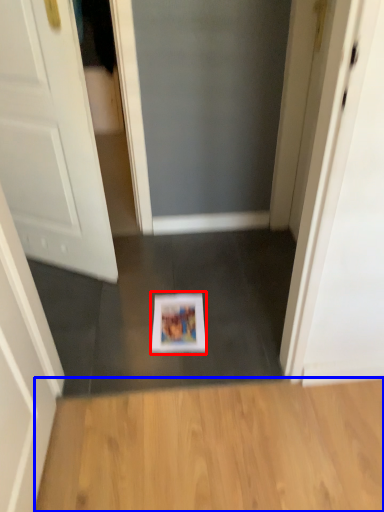
Question: Which of the following is the closest to the observer, magazine (highlighted by a red box) or hardwood (highlighted by a blue box)?

Choices:
 (A) magazine
 (B) hardwood

Answer: (B)